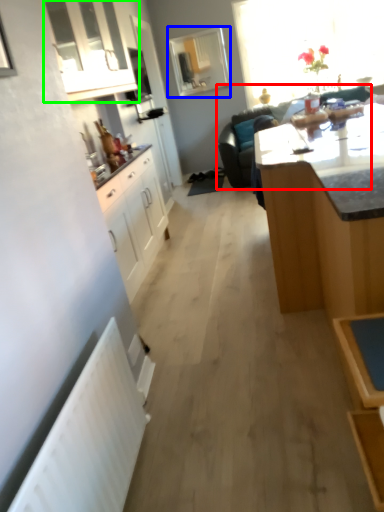
Question: Which object is positioned closest to studio couch (highlighted by a red box)? Select from window (highlighted by a blue box) and cabinetry (highlighted by a green box).

Choices:
 (A) window
 (B) cabinetry

Answer: (B)